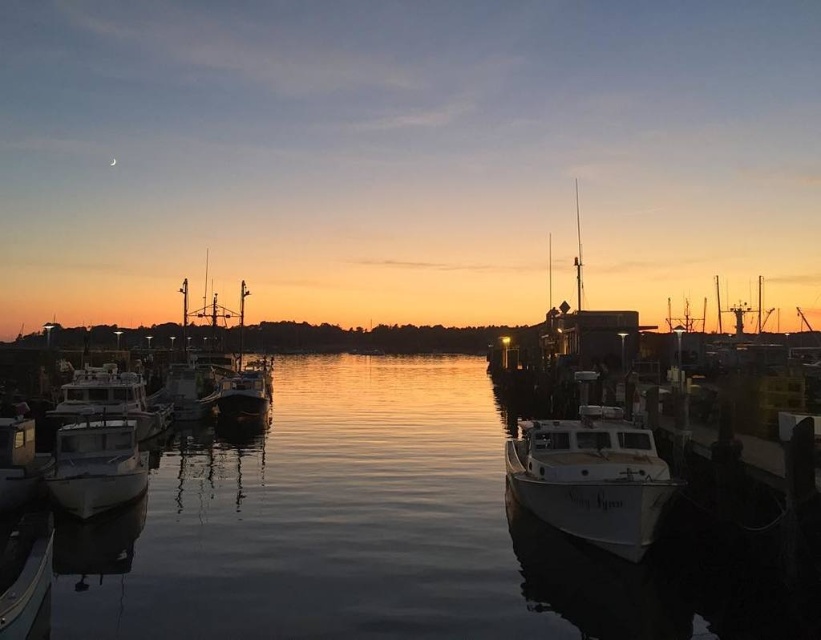
You are standing at the camera position and want to take a photo of the white matte boat at left. Can you reach it within 20 meters without moving the camera?

The white matte boat at left and camera are 20.01 meters apart, so you cannot reach it within 20 meters without moving the camera since the distance is slightly over the limit.

You are standing on the dock and see a point marked at coordinates (109, 400). Which object is this point located on?

The point at coordinates (109, 400) is located on the white matte boat at left.

You are a dock worker who needs to secure both the white matte boat at center and the metallic white boat at left. Which boat requires more space to maneuver around due to its size?

The metallic white boat at left requires more space to maneuver around because it has a greater width than the white matte boat at center.